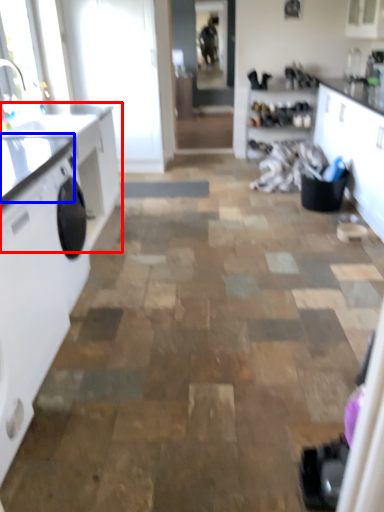
Question: Which of the following is the farthest to the observer, countertop (highlighted by a red box) or counter top (highlighted by a blue box)?

Choices:
 (A) countertop
 (B) counter top

Answer: (A)